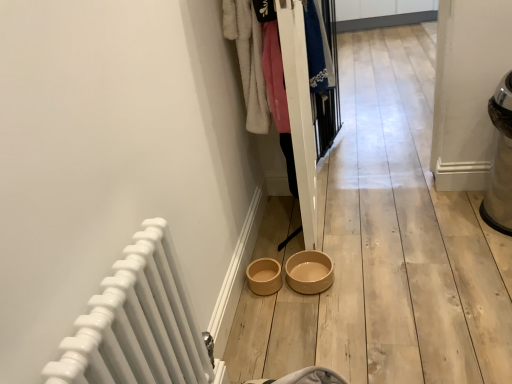
Question: From the image's perspective, is beige ceramic bowl at center located above or below white fluffy coat at upper center, which ranks as the second clothing in back-to-front order?

Choices:
 (A) below
 (B) above

Answer: (A)

Question: From a real-world perspective, is beige ceramic bowl at center above or below white fluffy coat at upper center, placed as the first clothing when sorted from left to right?

Choices:
 (A) below
 (B) above

Answer: (A)

Question: Considering the real-world distances, which object is farthest from the white glossy radiator at lower left?

Choices:
 (A) blue cotton shirt at center, which ranks as the first clothing in right-to-left order
 (B) white fluffy coat at upper center, acting as the 2th clothing starting from the right
 (C) beige ceramic bowl at center
 (D) white wooden closet at center

Answer: (A)

Question: Which object is the farthest from the white fluffy coat at upper center, the first clothing positioned from the front?

Choices:
 (A) blue cotton shirt at center, arranged as the second clothing when viewed from the front
 (B) white wooden closet at center
 (C) beige ceramic bowl at center
 (D) white glossy radiator at lower left

Answer: (D)